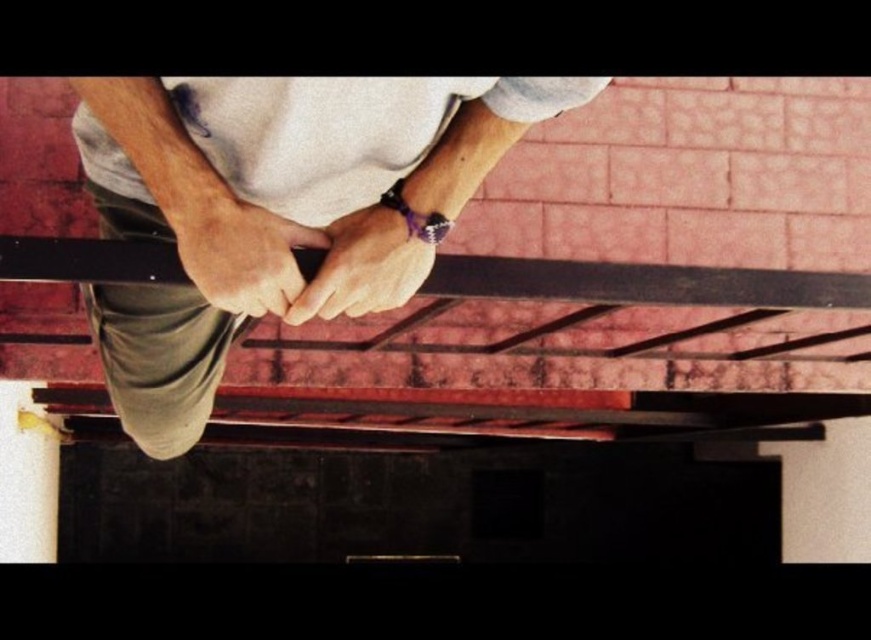
Question: Which point appears closest to the camera in this image?

Choices:
 (A) (287, 269)
 (B) (537, 269)

Answer: (A)

Question: Which object is closer to the camera taking this photo?

Choices:
 (A) satin brown leather hand at center
 (B) smooth skin hand at center
 (C) black matte beam at center

Answer: (B)

Question: Is black matte beam at center positioned before satin brown leather hand at center?

Choices:
 (A) yes
 (B) no

Answer: (B)

Question: Does matte black skateboard at center come in front of smooth skin hand at center?

Choices:
 (A) yes
 (B) no

Answer: (A)

Question: Is smooth skin hand at center thinner than satin brown leather hand at center?

Choices:
 (A) no
 (B) yes

Answer: (B)

Question: Estimate the real-world distances between objects in this image. Which object is closer to the matte black skateboard at center?

Choices:
 (A) smooth skin hand at center
 (B) satin brown leather hand at center
 (C) black matte beam at center

Answer: (C)